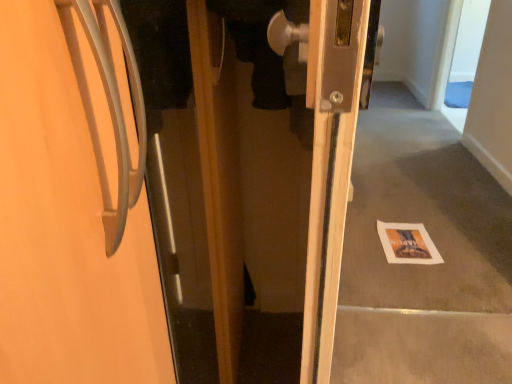
Question: Is white paper at lower right shorter than matte silver door at center?

Choices:
 (A) yes
 (B) no

Answer: (A)

Question: Considering the relative positions of white paper at lower right and matte silver door at center in the image provided, is white paper at lower right to the right of matte silver door at center from the viewer's perspective?

Choices:
 (A) no
 (B) yes

Answer: (B)

Question: Is matte silver door at center a part of white paper at lower right?

Choices:
 (A) yes
 (B) no

Answer: (B)

Question: From a real-world perspective, is white paper at lower right over matte silver door at center?

Choices:
 (A) yes
 (B) no

Answer: (B)

Question: Is white paper at lower right beside matte silver door at center?

Choices:
 (A) yes
 (B) no

Answer: (B)

Question: Considering the relative sizes of white paper at lower right and matte silver door at center in the image provided, is white paper at lower right bigger than matte silver door at center?

Choices:
 (A) no
 (B) yes

Answer: (A)

Question: Can you confirm if matte silver door at center is smaller than white paper at lower right?

Choices:
 (A) no
 (B) yes

Answer: (A)

Question: Is matte silver door at center closer to camera compared to white paper at lower right?

Choices:
 (A) no
 (B) yes

Answer: (B)

Question: Is matte silver door at center not close to white paper at lower right?

Choices:
 (A) yes
 (B) no

Answer: (A)

Question: Is matte silver door at center oriented away from white paper at lower right?

Choices:
 (A) no
 (B) yes

Answer: (A)

Question: Is matte silver door at center further to camera compared to white paper at lower right?

Choices:
 (A) no
 (B) yes

Answer: (A)

Question: From a real-world perspective, is matte silver door at center over white paper at lower right?

Choices:
 (A) yes
 (B) no

Answer: (A)

Question: Is matte silver door at center inside or outside of white paper at lower right?

Choices:
 (A) outside
 (B) inside

Answer: (A)